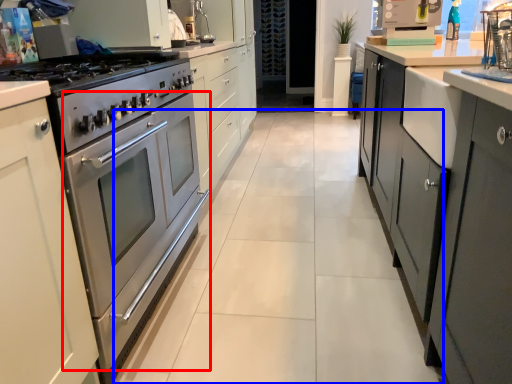
Question: Which of the following is the farthest to the observer, oven (highlighted by a red box) or plain (highlighted by a blue box)?

Choices:
 (A) oven
 (B) plain

Answer: (B)